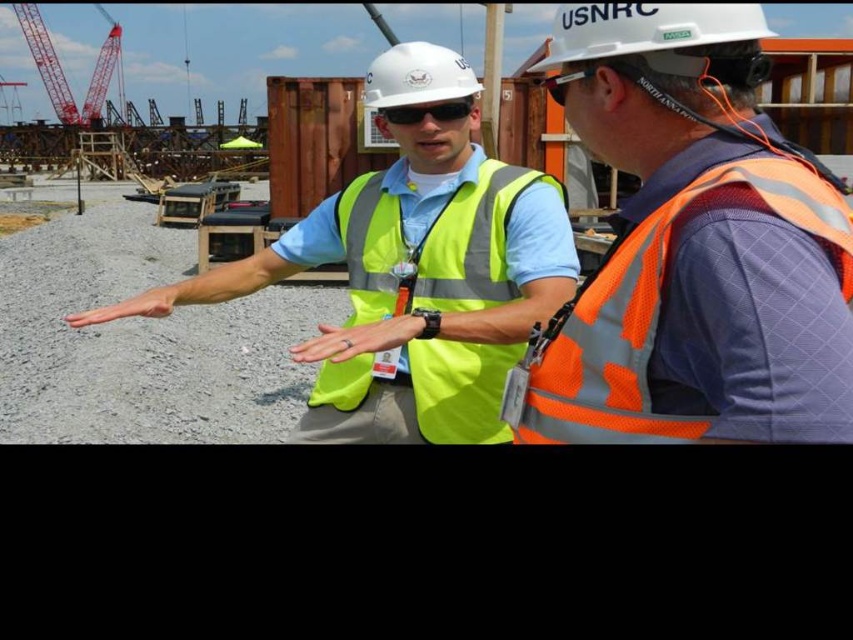
Question: Among these objects, which one is farthest from the camera?

Choices:
 (A) matte black goggles at upper center
 (B) high-visibility yellow vest at center

Answer: (B)

Question: Estimate the real-world distances between objects in this image. Which object is closer to the orange reflective safety vest at right?

Choices:
 (A) high-visibility fabric safety vest at center
 (B) matte yellow hand at center
 (C) white hard hat at center
 (D) yellow reflective vest at center

Answer: (D)

Question: Is the position of white hard hat at center more distant than that of yellow reflective vest at center?

Choices:
 (A) no
 (B) yes

Answer: (B)

Question: Which of the following is the farthest from the observer?

Choices:
 (A) matte yellow hand at center
 (B) black plastic sunglasses at center
 (C) orange reflective safety vest at right
 (D) white hard hat at center

Answer: (D)

Question: Is high-visibility yellow vest at center thinner than high-visibility fabric safety vest at center?

Choices:
 (A) yes
 (B) no

Answer: (B)

Question: Does high-visibility yellow vest at center have a smaller size compared to matte black goggles at upper center?

Choices:
 (A) no
 (B) yes

Answer: (A)